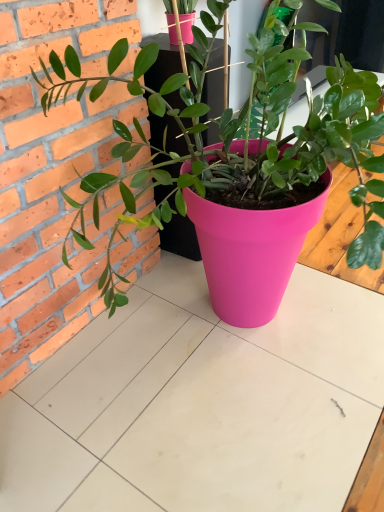
Question: Is matte pink pot at center smaller than matte pink pot at center?

Choices:
 (A) no
 (B) yes

Answer: (A)

Question: Is matte pink pot at center aimed at matte pink pot at center?

Choices:
 (A) no
 (B) yes

Answer: (A)

Question: From the image's perspective, would you say matte pink pot at center is positioned over matte pink pot at center?

Choices:
 (A) yes
 (B) no

Answer: (A)

Question: Is matte pink pot at center further to camera compared to matte pink pot at center?

Choices:
 (A) yes
 (B) no

Answer: (B)

Question: Can you confirm if matte pink pot at center is bigger than matte pink pot at center?

Choices:
 (A) no
 (B) yes

Answer: (B)

Question: Is matte pink pot at center to the left of matte pink pot at center from the viewer's perspective?

Choices:
 (A) no
 (B) yes

Answer: (B)

Question: From a real-world perspective, is matte pink pot at center located beneath matte pink pot at center?

Choices:
 (A) yes
 (B) no

Answer: (A)

Question: Can you confirm if matte pink pot at center is taller than matte pink pot at center?

Choices:
 (A) no
 (B) yes

Answer: (A)

Question: Considering the relative sizes of matte pink pot at center and matte pink pot at center in the image provided, is matte pink pot at center smaller than matte pink pot at center?

Choices:
 (A) yes
 (B) no

Answer: (A)

Question: From the image's perspective, does matte pink pot at center appear higher than matte pink pot at center?

Choices:
 (A) yes
 (B) no

Answer: (B)

Question: Is matte pink pot at center far from matte pink pot at center?

Choices:
 (A) no
 (B) yes

Answer: (A)

Question: Is matte pink pot at center turned away from matte pink pot at center?

Choices:
 (A) yes
 (B) no

Answer: (B)

Question: Is matte pink pot at center inside or outside of matte pink pot at center?

Choices:
 (A) inside
 (B) outside

Answer: (B)